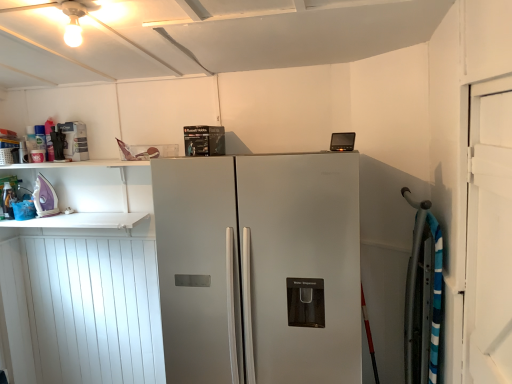
Question: Is matte white spray can at upper left, acting as the 2th appliance starting from the left, directly adjacent to white wood door at right?

Choices:
 (A) no
 (B) yes

Answer: (A)

Question: Does matte white spray can at upper left, acting as the 2th appliance starting from the left, come in front of white wood door at right?

Choices:
 (A) yes
 (B) no

Answer: (B)

Question: From a real-world perspective, is matte white spray can at upper left, placed as the 1th appliance when sorted from right to left, on white wood door at right?

Choices:
 (A) yes
 (B) no

Answer: (A)

Question: Considering the relative sizes of matte white spray can at upper left, acting as the 2th appliance starting from the left, and white wood door at right in the image provided, is matte white spray can at upper left, acting as the 2th appliance starting from the left, smaller than white wood door at right?

Choices:
 (A) yes
 (B) no

Answer: (A)

Question: Does matte white spray can at upper left, the 2th appliance from the bottom, turn towards white wood door at right?

Choices:
 (A) no
 (B) yes

Answer: (A)

Question: Is matte white spray can at upper left, placed as the 1th appliance when sorted from right to left, positioned behind white wood door at right?

Choices:
 (A) no
 (B) yes

Answer: (B)

Question: From a real-world perspective, is satin silver refrigerator at center on top of white wood door at right?

Choices:
 (A) no
 (B) yes

Answer: (A)

Question: From the image's perspective, is satin silver refrigerator at center on white wood door at right?

Choices:
 (A) yes
 (B) no

Answer: (B)

Question: Is satin silver refrigerator at center turned away from white wood door at right?

Choices:
 (A) yes
 (B) no

Answer: (B)

Question: Can you confirm if satin silver refrigerator at center is smaller than white wood door at right?

Choices:
 (A) yes
 (B) no

Answer: (B)

Question: Can you confirm if satin silver refrigerator at center is taller than white wood door at right?

Choices:
 (A) yes
 (B) no

Answer: (A)

Question: Is satin silver refrigerator at center bigger than white wood door at right?

Choices:
 (A) yes
 (B) no

Answer: (A)

Question: From the image's perspective, is matte white spray can at upper left, acting as the 1th appliance starting from the top, on top of purple glossy iron at left, which is the 1th appliance from left to right?

Choices:
 (A) no
 (B) yes

Answer: (B)